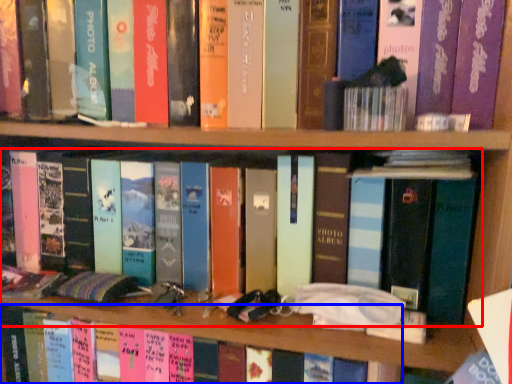
Question: Which point is further to the camera, book (highlighted by a red box) or book (highlighted by a blue box)?

Choices:
 (A) book
 (B) book

Answer: (B)